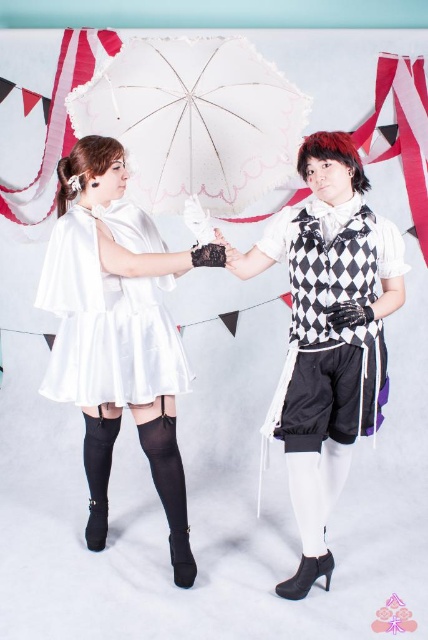
You are a costume designer who needs to place a 6 inch wide accessory between the two vests. Can you fit it between the matte black vest at center and the black and white checkered vest at right?

The distance between the matte black vest at center and the black and white checkered vest at right is 7.35 inches. Since the accessory is 6 inches wide, there is enough space to place it between them as 7.35 inches is greater than 6 inches.

Based on the scene description, which vest is wider, the matte black vest at center or the black and white checkered vest at right?

The matte black vest at center is wider than the black and white checkered vest at right according to the description.

You are a photographer at the event and want to ensure the matte black vest at center stays dry during a fake rain effect. The white lace umbrella at center is being held by the model. Based on their positions, will the umbrella provide adequate coverage to keep the vest dry?

The matte black vest at center is positioned under the white lace umbrella at center, so yes, the umbrella will provide adequate coverage to keep the vest dry during the fake rain effect.